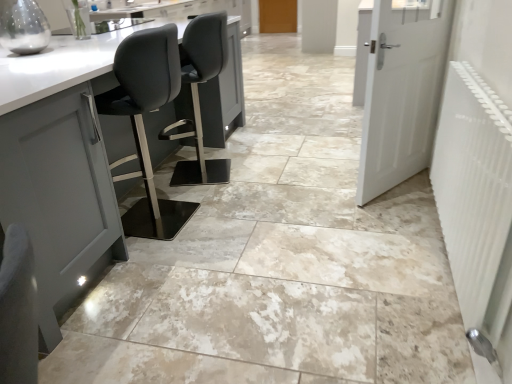
What are the coordinates of `free space that is to the left of white matte door at right, which is the second door in back-to-front order` in the screenshot? It's located at (315, 187).